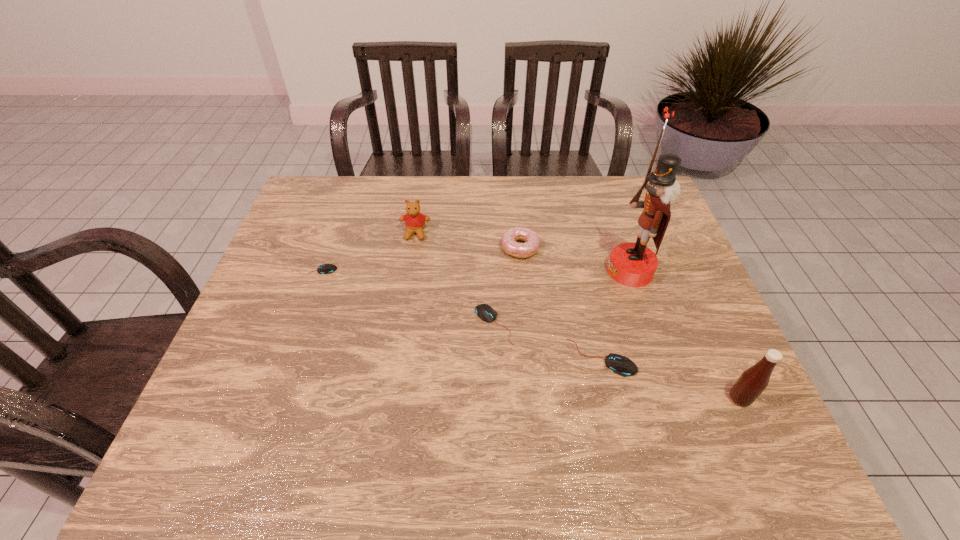
Find the location of a particular element. Image resolution: width=960 pixels, height=540 pixels. object that is the fourth closest to the shortest object is located at coordinates tap(621, 365).

Point out which object is positioned as the second nearest to the nearest object. Please provide its 2D coordinates. Your answer should be formatted as a tuple, i.e. [(x, y)], where the tuple contains the x and y coordinates of a point satisfying the conditions above.

[(631, 264)]

Where is `the second closest mouse to the rightmost mouse`? The image size is (960, 540). the second closest mouse to the rightmost mouse is located at coordinates (324, 268).

Identify which mouse is located as the nearest to the second tallest mouse. Please provide its 2D coordinates. Your answer should be formatted as a tuple, i.e. [(x, y)], where the tuple contains the x and y coordinates of a point satisfying the conditions above.

[(621, 365)]

Find the location of a particular element. vacant region that satisfies the following two spatial constraints: 1. on the back side of the fourth shortest object; 2. on the right side of the second shortest object is located at coordinates (492, 248).

At what (x,y) coordinates should I click in order to perform the action: click on free location that satisfies the following two spatial constraints: 1. on the front-facing side of the third tallest object; 2. on the left side of the rightmost mouse. Please return your answer as a coordinate pair (x, y). The image size is (960, 540). Looking at the image, I should click on (396, 357).